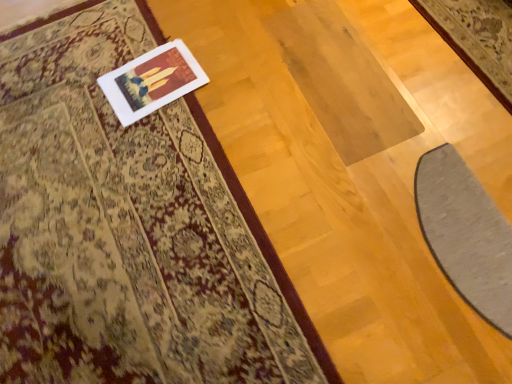
Question: Considering the positions of point (436, 150) and point (303, 357), is point (436, 150) closer or farther from the camera than point (303, 357)?

Choices:
 (A) closer
 (B) farther

Answer: (B)

Question: Based on their sizes in the image, would you say gray soft mat at lower right is bigger or smaller than silky beige rug at upper left?

Choices:
 (A) small
 (B) big

Answer: (A)

Question: Which object is the closest to the white matte picture frame at upper left?

Choices:
 (A) gray soft mat at lower right
 (B) silky beige rug at upper left

Answer: (B)

Question: Estimate the real-world distances between objects in this image. Which object is closer to the white matte picture frame at upper left?

Choices:
 (A) gray soft mat at lower right
 (B) silky beige rug at upper left

Answer: (B)